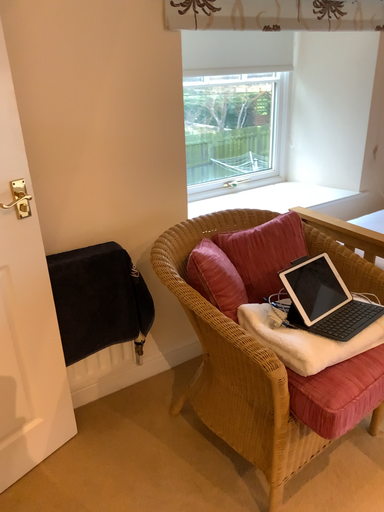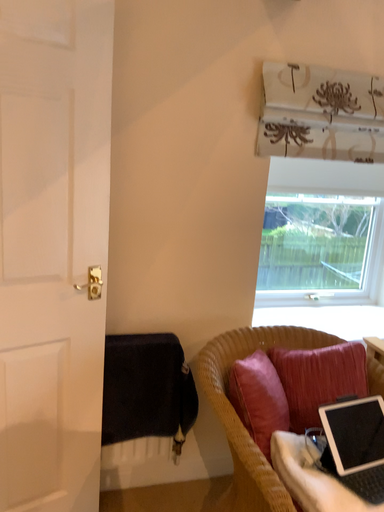
Question: Which way did the camera rotate in the video?

Choices:
 (A) rotated upward
 (B) rotated downward

Answer: (A)